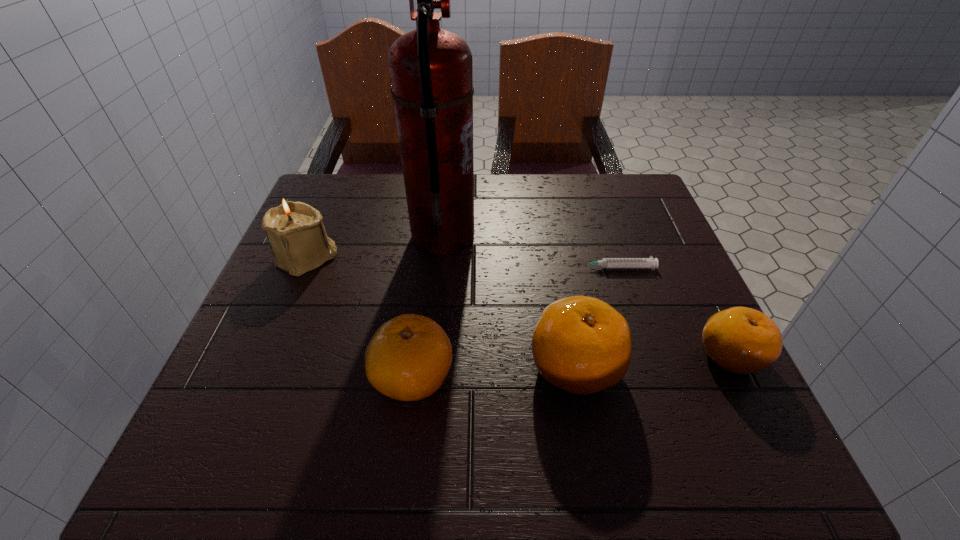
I want to click on vacant space in between the tallest object and the syringe, so click(529, 252).

Identify the location of free space between the second clementine from right to left and the second tallest object. The width and height of the screenshot is (960, 540). (441, 312).

Locate an element on the screen. This screenshot has height=540, width=960. vacant region between the second tallest clementine and the second clementine from left to right is located at coordinates (493, 372).

This screenshot has width=960, height=540. Identify the location of empty location between the syringe and the leftmost object. (461, 262).

Locate an element on the screen. The width and height of the screenshot is (960, 540). free spot between the second clementine from right to left and the second tallest object is located at coordinates (441, 312).

This screenshot has height=540, width=960. I want to click on free space that is in between the fire extinguisher and the candle_holder, so click(x=375, y=247).

Locate an element on the screen. The image size is (960, 540). empty space that is in between the shortest object and the leftmost clementine is located at coordinates (514, 322).

Where is `object that ranks as the closest to the second clementine from left to right`? This screenshot has height=540, width=960. object that ranks as the closest to the second clementine from left to right is located at coordinates (408, 358).

In order to click on object that is the fifth closest to the shortest object in this screenshot , I will do `click(295, 231)`.

Select which clementine is the second closest to the third shortest object. Please provide its 2D coordinates. Your answer should be formatted as a tuple, i.e. [(x, y)], where the tuple contains the x and y coordinates of a point satisfying the conditions above.

[(742, 340)]